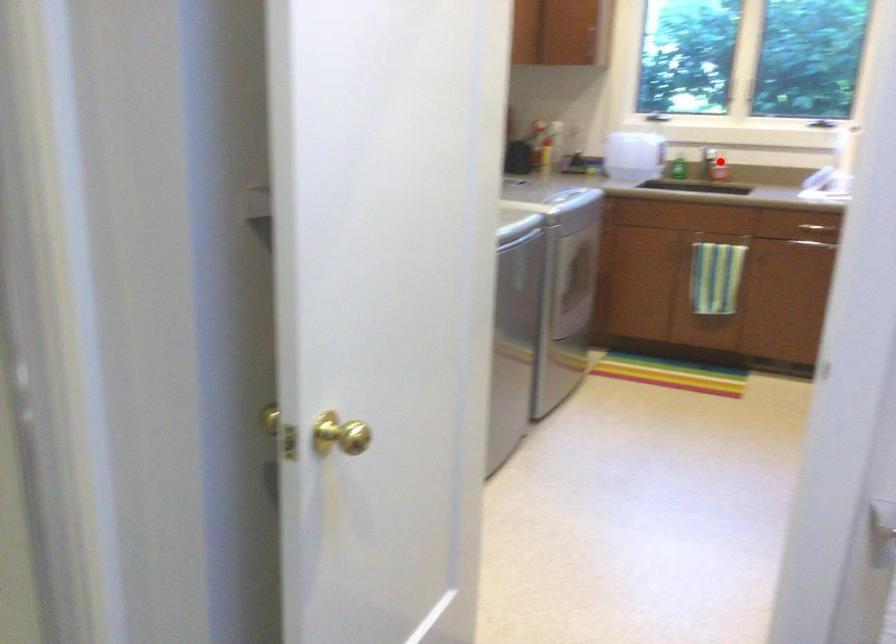
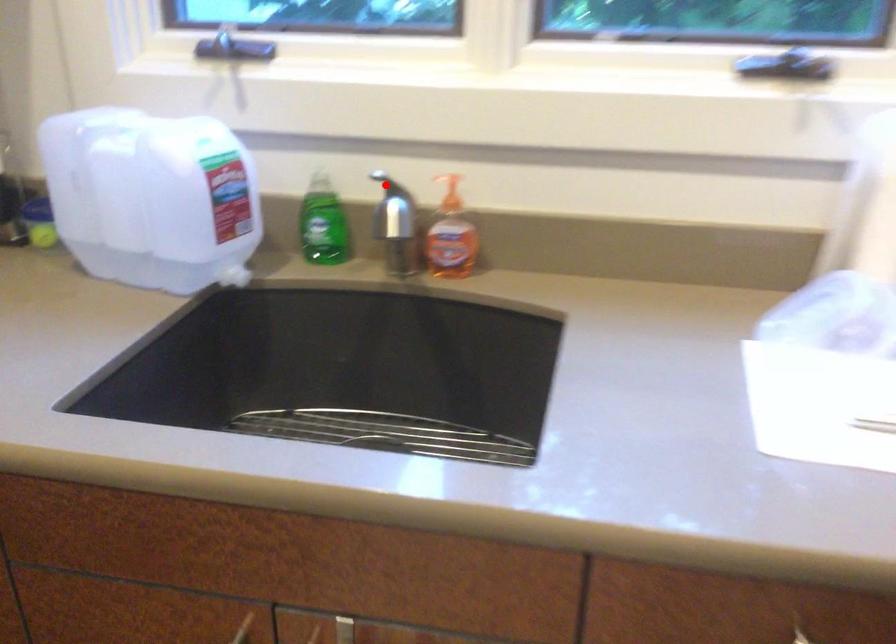
I am providing you with two images of the same scene from different viewpoints. A red point is marked on the first image and another point is marked on the second image. Is the marked point in image1 the same physical position as the marked point in image2?

No